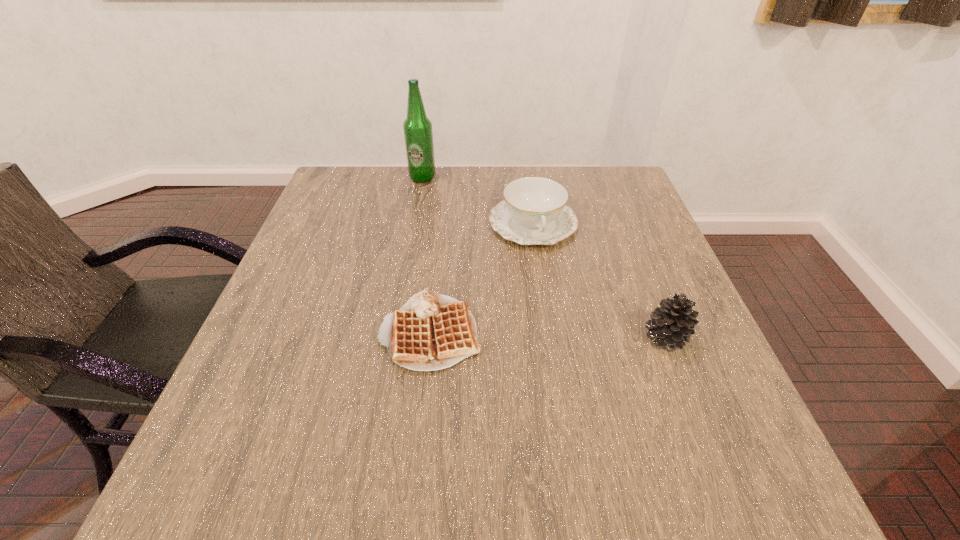
The image size is (960, 540). I want to click on free space between the third shortest object and the waffle, so coord(548,335).

Identify the location of vacant space in between the second tallest object and the waffle. The image size is (960, 540). (548, 335).

Locate an element on the screen. The height and width of the screenshot is (540, 960). free space between the chinaware and the waffle is located at coordinates (482, 278).

Identify the location of free space between the tallest object and the third object from left to right. The image size is (960, 540). (477, 200).

Locate an element on the screen. object that stands as the third closest to the second tallest object is located at coordinates (418, 134).

Locate which object is the third closest to the farthest object. Please provide its 2D coordinates. Your answer should be formatted as a tuple, i.e. [(x, y)], where the tuple contains the x and y coordinates of a point satisfying the conditions above.

[(672, 324)]